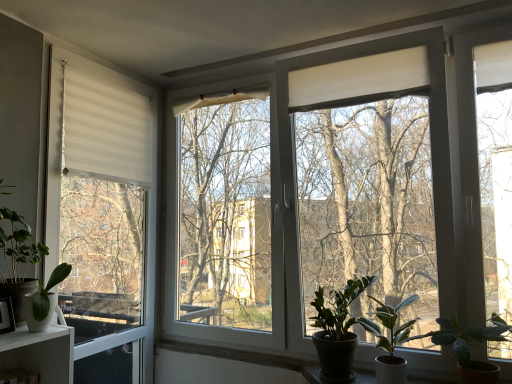
Question: Considering the relative sizes of green matte plant at lower right, the second houseplant in the right-to-left sequence, and green matte plant at left, which is counted as the first houseplant, starting from the left, in the image provided, is green matte plant at lower right, the second houseplant in the right-to-left sequence, bigger than green matte plant at left, which is counted as the first houseplant, starting from the left,?

Choices:
 (A) yes
 (B) no

Answer: (A)

Question: Would you consider green matte plant at lower right, which is the 4th houseplant in left-to-right order, to be distant from green matte plant at left, which is counted as the first houseplant, starting from the left?

Choices:
 (A) no
 (B) yes

Answer: (B)

Question: Considering the relative sizes of green matte plant at lower right, which is the 4th houseplant in left-to-right order, and green matte plant at left, which is counted as the first houseplant, starting from the left, in the image provided, is green matte plant at lower right, which is the 4th houseplant in left-to-right order, wider than green matte plant at left, which is counted as the first houseplant, starting from the left,?

Choices:
 (A) no
 (B) yes

Answer: (B)

Question: Can you confirm if green matte plant at lower right, the second houseplant in the right-to-left sequence, is thinner than green matte plant at left, which is counted as the first houseplant, starting from the left?

Choices:
 (A) no
 (B) yes

Answer: (A)

Question: Does green matte plant at lower right, the second houseplant in the right-to-left sequence, touch green matte plant at left, the 5th houseplant viewed from the right?

Choices:
 (A) no
 (B) yes

Answer: (A)

Question: From the image's perspective, is white matte window at left located above or below dark green glossy plant at lower right, the third houseplant positioned from the right?

Choices:
 (A) above
 (B) below

Answer: (A)

Question: Is white matte window at left bigger or smaller than dark green glossy plant at lower right, arranged as the third houseplant when viewed from the left?

Choices:
 (A) big
 (B) small

Answer: (A)

Question: From a real-world perspective, is white matte window at left physically located above or below dark green glossy plant at lower right, the third houseplant positioned from the right?

Choices:
 (A) above
 (B) below

Answer: (A)

Question: In the image, is white matte window at left positioned in front of or behind dark green glossy plant at lower right, arranged as the third houseplant when viewed from the left?

Choices:
 (A) front
 (B) behind

Answer: (B)

Question: From the image's perspective, is green matte plant at left, which is counted as the first houseplant, starting from the left, positioned above or below white matte window at left?

Choices:
 (A) below
 (B) above

Answer: (A)

Question: In the image, is green matte plant at left, the 5th houseplant viewed from the right, positioned in front of or behind white matte window at left?

Choices:
 (A) front
 (B) behind

Answer: (A)

Question: Would you say green matte plant at left, the 5th houseplant viewed from the right, is to the left or to the right of white matte window at left in the picture?

Choices:
 (A) right
 (B) left

Answer: (B)

Question: In terms of width, does green matte plant at left, which is counted as the first houseplant, starting from the left, look wider or thinner when compared to white matte window at left?

Choices:
 (A) thin
 (B) wide

Answer: (B)

Question: Considering the positions of green matte plant at left, the 5th houseplant viewed from the right, and dark green glossy plant at lower right, arranged as the third houseplant when viewed from the left, in the image, is green matte plant at left, the 5th houseplant viewed from the right, taller or shorter than dark green glossy plant at lower right, arranged as the third houseplant when viewed from the left,?

Choices:
 (A) short
 (B) tall

Answer: (B)

Question: In terms of width, does green matte plant at left, the 5th houseplant viewed from the right, look wider or thinner when compared to dark green glossy plant at lower right, the third houseplant positioned from the right?

Choices:
 (A) wide
 (B) thin

Answer: (B)